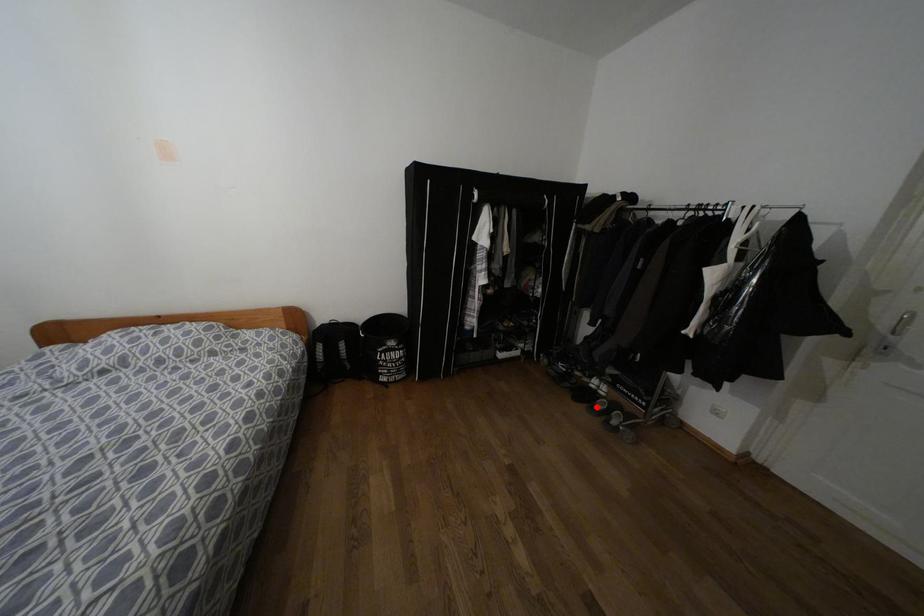
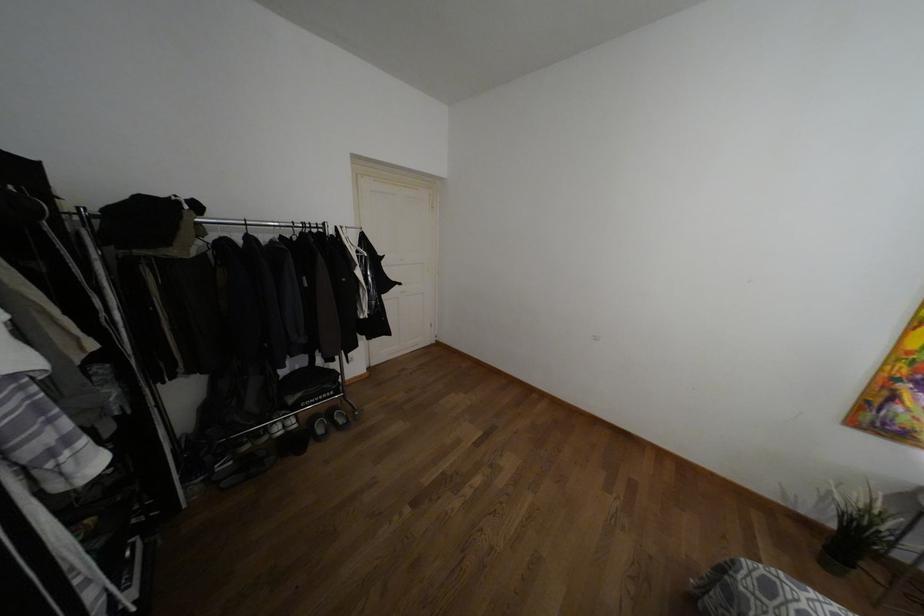
Locate, in the second image, the point that corresponds to the highlighted location in the first image.

(320, 430)